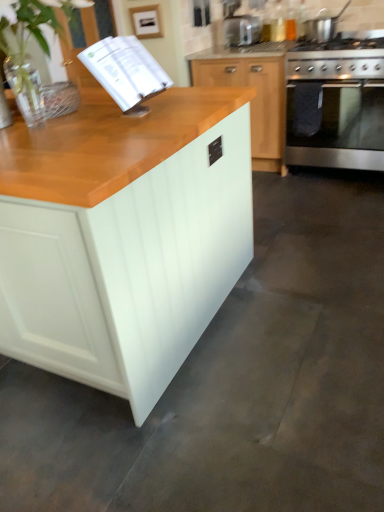
Identify the location of free space in front of white paper book at upper left. (129, 133).